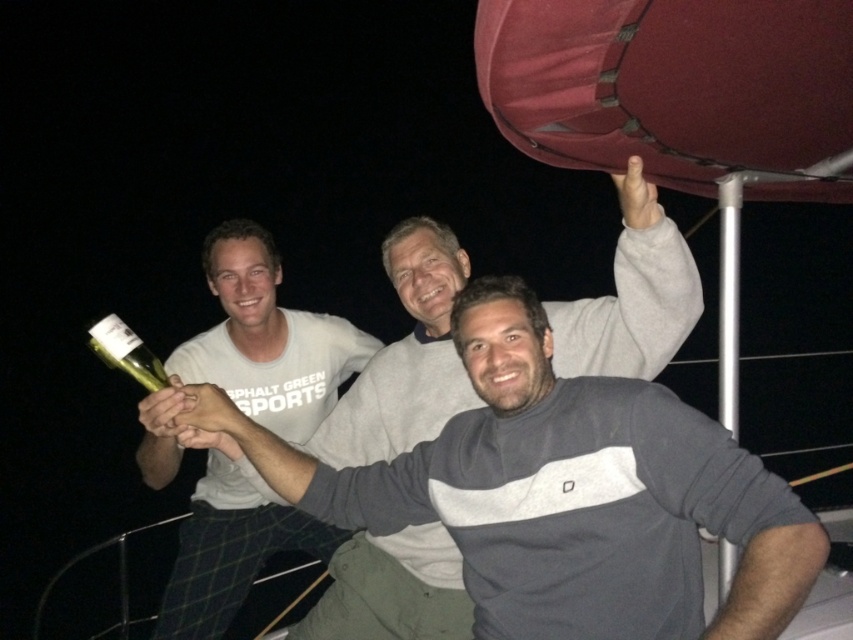
Question: Which is nearer to the gray cotton shirt at center?

Choices:
 (A) green glass bottle at lower left
 (B) white matte t-shirt at left

Answer: (B)

Question: Considering the relative positions of gray cotton shirt at center and white matte t-shirt at left in the image provided, where is gray cotton shirt at center located with respect to white matte t-shirt at left?

Choices:
 (A) right
 (B) left

Answer: (A)

Question: Which point is farther to the camera?

Choices:
 (A) (436, 323)
 (B) (212, 579)

Answer: (B)

Question: Does gray cotton shirt at center appear on the right side of green glass bottle at lower left?

Choices:
 (A) yes
 (B) no

Answer: (A)

Question: Which point is closer to the camera?

Choices:
 (A) gray cotton shirt at center
 (B) green glass bottle at lower left
 (C) white matte t-shirt at left

Answer: (B)

Question: Where is white matte t-shirt at left located in relation to green glass bottle at lower left in the image?

Choices:
 (A) left
 (B) right

Answer: (B)